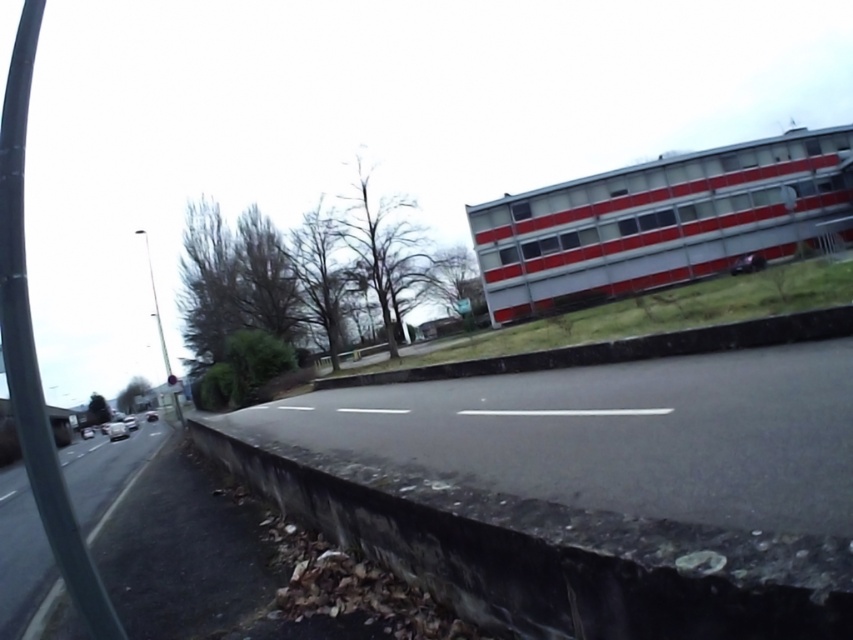
Question: Which object appears closest to the camera in this image?

Choices:
 (A) white glossy car at lower left
 (B) concrete curb at lower center
 (C) silver metallic car at left

Answer: (B)

Question: Which object is the farthest from the silver metallic car at lower left?

Choices:
 (A) concrete curb at lower center
 (B) silver metallic car at left
 (C) white glossy car at lower left

Answer: (A)

Question: Does metallic silver car at right appear on the left side of silver metallic car at center?

Choices:
 (A) yes
 (B) no

Answer: (B)

Question: Which point is farther to the camera?

Choices:
 (A) concrete curb at lower center
 (B) white glossy car at lower left

Answer: (B)

Question: Is concrete curb at lower center wider than silver metallic car at center?

Choices:
 (A) yes
 (B) no

Answer: (B)

Question: Can you confirm if concrete at center is positioned to the left of silver metallic car at lower left?

Choices:
 (A) yes
 (B) no

Answer: (B)